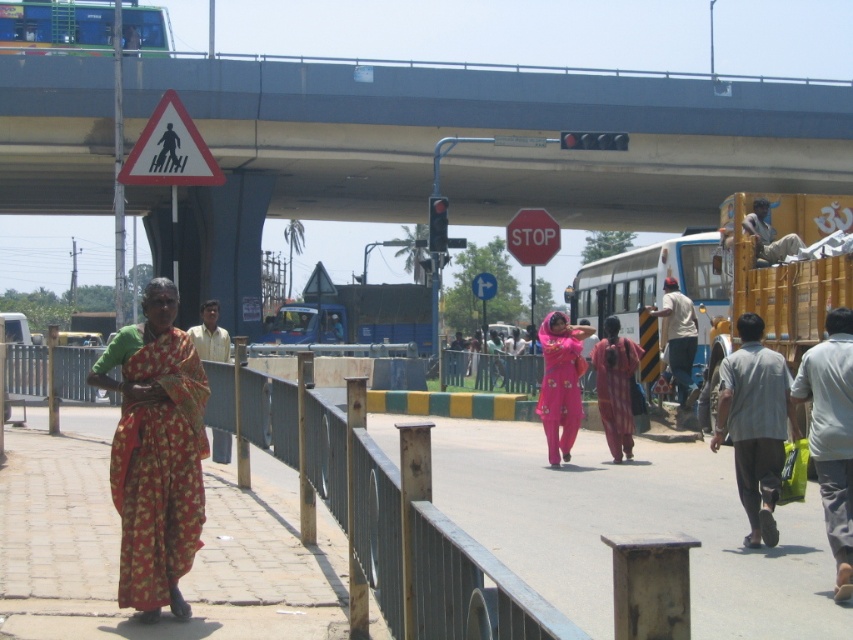
Is white matte school bus at center to the right of red matte stop sign at center from the viewer's perspective?

Yes, white matte school bus at center is to the right of red matte stop sign at center.

Which is in front, point (695, 360) or point (544, 259)?

Positioned in front is point (695, 360).

Does point (648, 252) come farther from viewer compared to point (541, 243)?

No, (648, 252) is in front of (541, 243).

Find the location of a particular element. The width and height of the screenshot is (853, 640). white matte school bus at center is located at coordinates (653, 284).

Who is taller, white matte school bus at center or light beige shirt at center?

white matte school bus at center is taller.

Can you confirm if white matte school bus at center is positioned below light beige shirt at center?

No.

Between point (625, 275) and point (669, 360), which one is positioned behind?

Point (625, 275)

Identify the location of white matte school bus at center. This screenshot has height=640, width=853. (653, 284).

Does white matte school bus at center appear over white triangular pedestrian sign at upper left?

Actually, white matte school bus at center is below white triangular pedestrian sign at upper left.

Is white matte school bus at center wider than white triangular pedestrian sign at upper left?

Indeed, white matte school bus at center has a greater width compared to white triangular pedestrian sign at upper left.

What do you see at coordinates (653, 284) in the screenshot? The width and height of the screenshot is (853, 640). I see `white matte school bus at center` at bounding box center [653, 284].

Locate an element on the screen. This screenshot has height=640, width=853. white matte school bus at center is located at coordinates (653, 284).